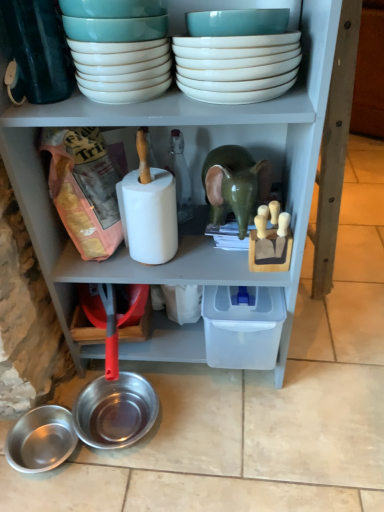
Find the location of a particular element. vacant space that is in between shiny metallic bowl at lower left, the fourth bowl viewed from the top, and shiny metallic bowl at lower left, acting as the third bowl starting from the top is located at coordinates (100, 452).